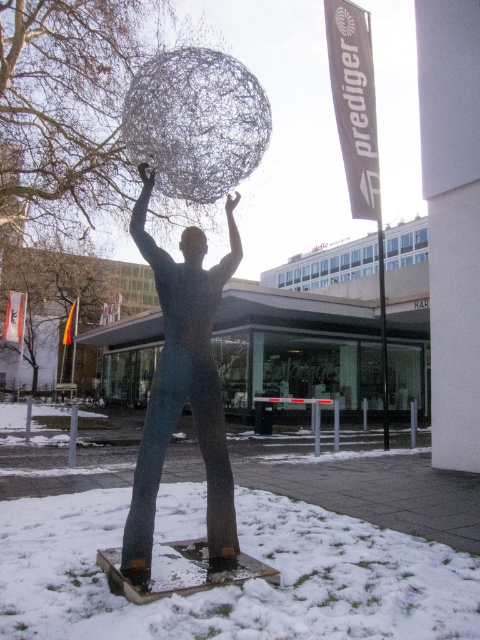
Question: Which of the following is the farthest from the observer?

Choices:
 (A) smooth skin head at center
 (B) metallic wire sculpture at center

Answer: (A)

Question: Where is metallic wire sculpture at center located in relation to smooth skin head at center in the image?

Choices:
 (A) above
 (B) below

Answer: (B)

Question: Considering the relative positions of metallic wire sculpture at center and smooth skin head at center in the image provided, where is metallic wire sculpture at center located with respect to smooth skin head at center?

Choices:
 (A) left
 (B) right

Answer: (A)

Question: Which point is farther to the camera?

Choices:
 (A) metallic wire sculpture at center
 (B) smooth skin head at center

Answer: (B)

Question: Which of the following is the farthest from the observer?

Choices:
 (A) metallic wire sculpture at center
 (B) smooth skin head at center

Answer: (B)

Question: Is metallic wire sculpture at center positioned in front of smooth skin head at center?

Choices:
 (A) no
 (B) yes

Answer: (B)